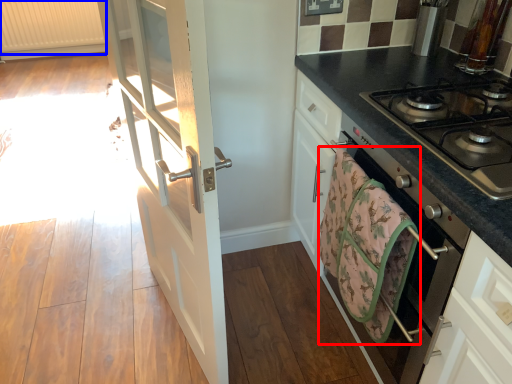
Question: Which point is closer to the camera, hand towel (highlighted by a red box) or radiator (highlighted by a blue box)?

Choices:
 (A) hand towel
 (B) radiator

Answer: (A)